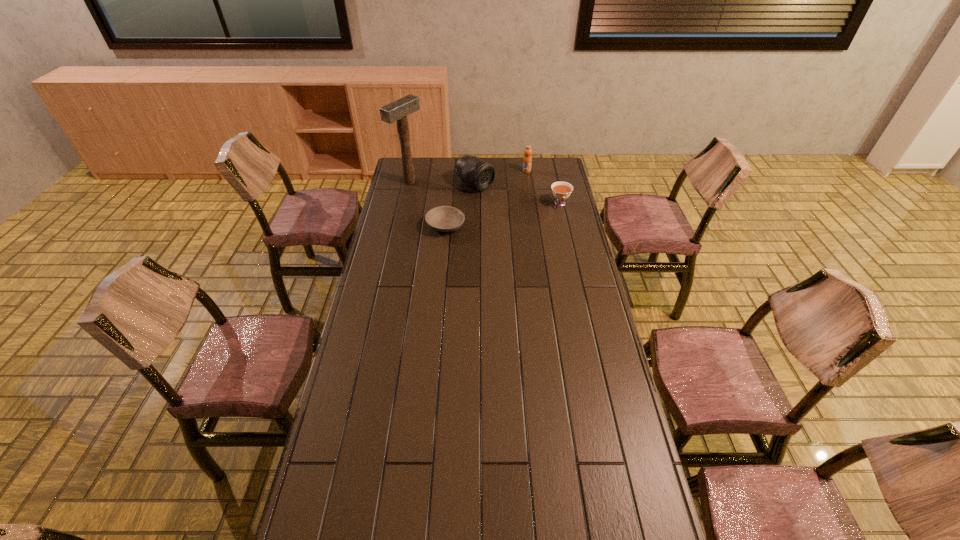
I want to click on object that can be found as the fourth closest to the mallet, so click(561, 190).

You are a GUI agent. You are given a task and a screenshot of the screen. Output one action in this format:
    pyautogui.click(x=<x>, y=<y>)
    Task: Click on the vacant space that satisfies the following two spatial constraints: 1. on the back side of the telephoto lens; 2. on the left side of the bowl
    
    Given the screenshot: What is the action you would take?
    pyautogui.click(x=449, y=185)

Locate an element on the screen. The height and width of the screenshot is (540, 960). vacant region that satisfies the following two spatial constraints: 1. on the back side of the telephoto lens; 2. on the right side of the orange juice is located at coordinates [x=475, y=171].

Locate an element on the screen. The height and width of the screenshot is (540, 960). vacant point that satisfies the following two spatial constraints: 1. on the front side of the tallest object; 2. on the left side of the bowl is located at coordinates (400, 226).